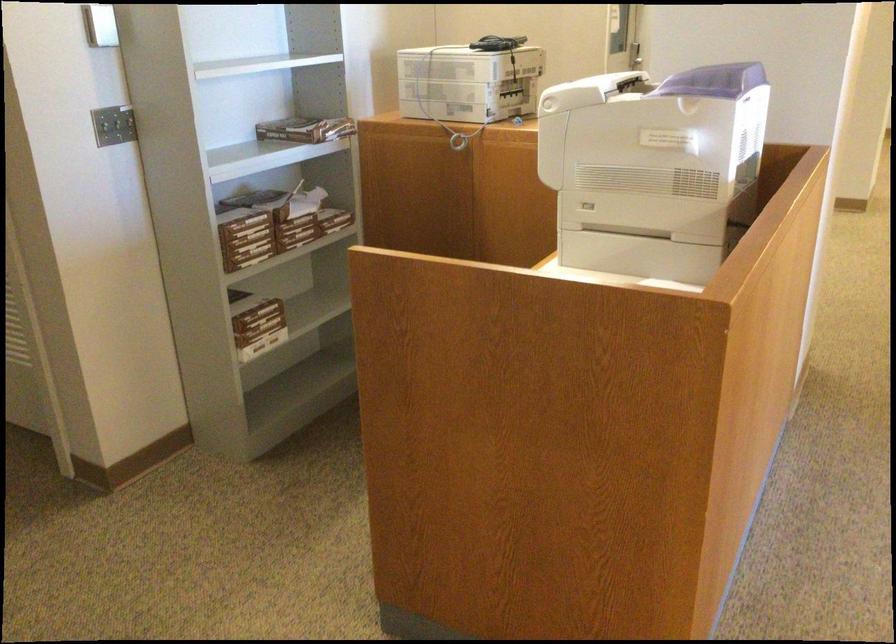
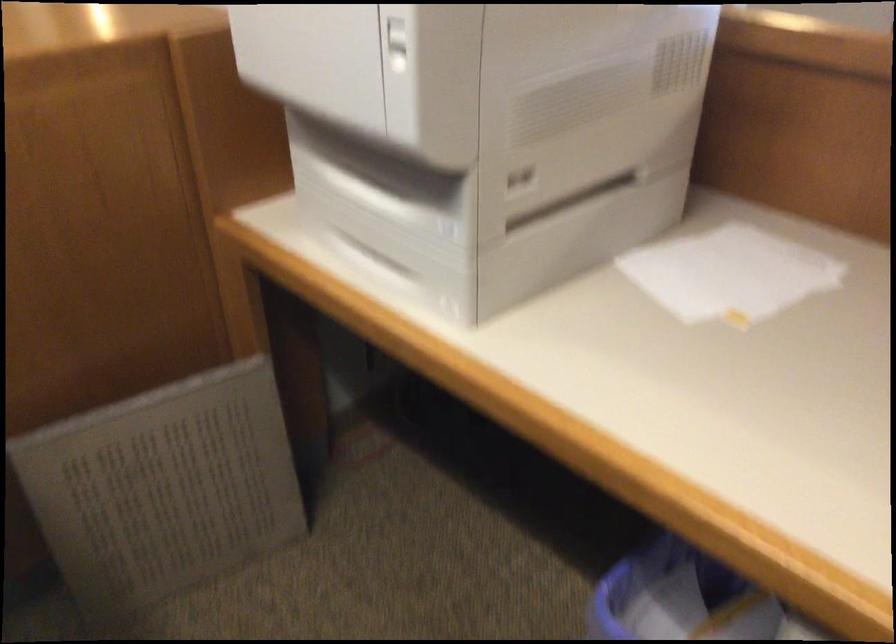
Find the pixel in the second image that matches (x=575, y=205) in the first image.

(391, 220)